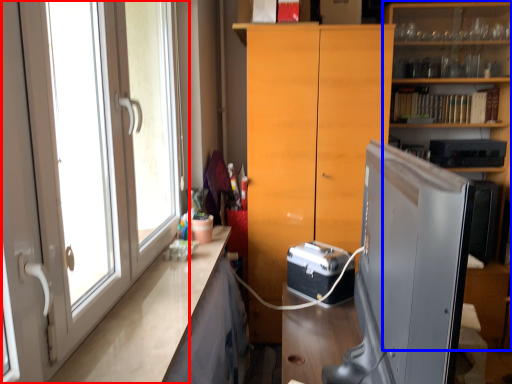
Question: Which object appears farthest to the camera in this image, door (highlighted by a red box) or shelf (highlighted by a blue box)?

Choices:
 (A) door
 (B) shelf

Answer: (B)